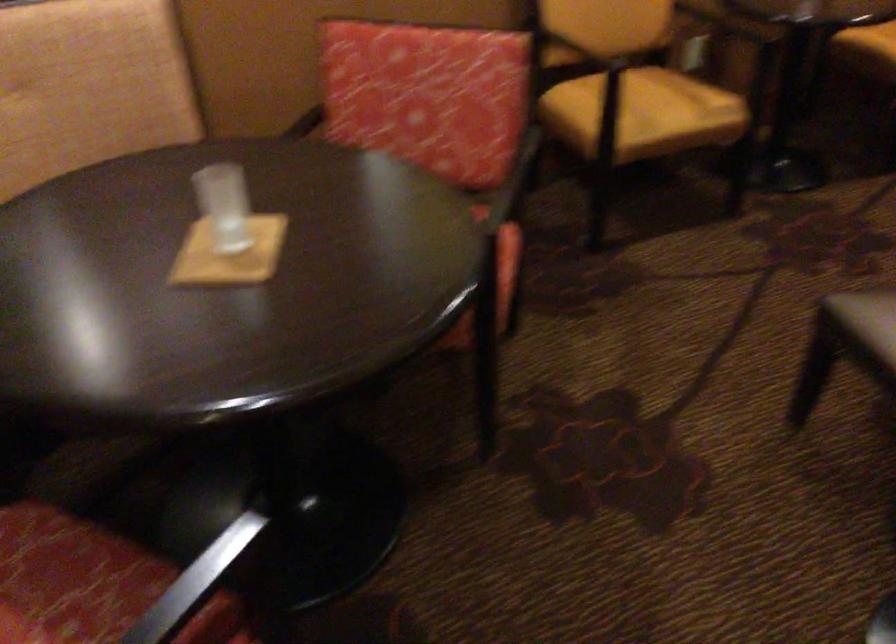
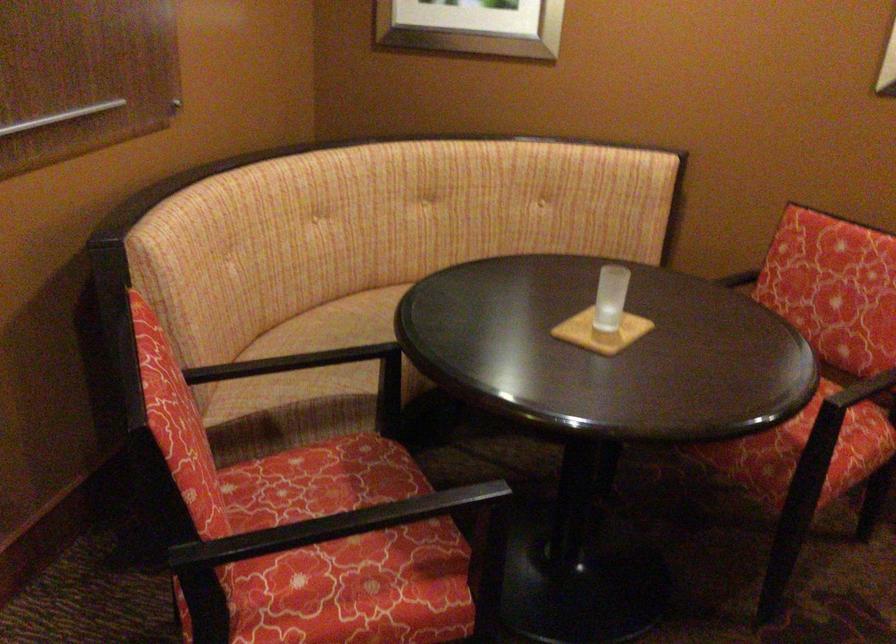
The point at (238, 250) is marked in the first image. Where is the corresponding point in the second image?

(600, 332)